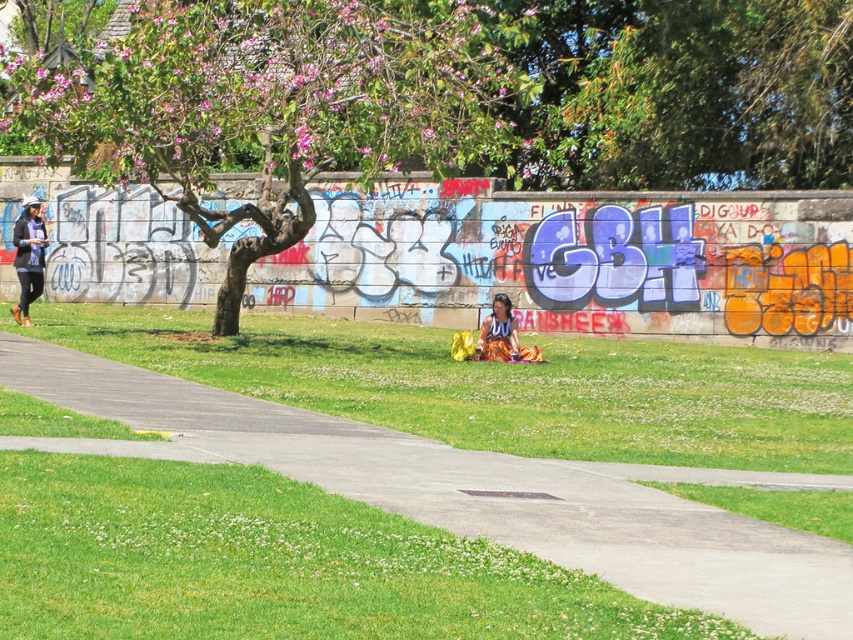
You are a gardener who needs to water the green grass at center. You have a watering can that can spray water up to 3 meters. Is the pink flowered tree at upper left within range of your watering can?

The pink flowered tree at upper left is 3.18 meters from the green grass at center. Since the watering can can only spray up to 3 meters, the distance is slightly beyond its range. Therefore, the pink flowered tree at upper left is out of reach of the watering can.

You are planning to place a small garden statue that requires a stable, flat surface. Based on the scene, which object between the gray concrete pavement at center and the green grass at center would be more suitable for placing the statue?

The gray concrete pavement at center is below the green grass at center, so the gray concrete pavement at center would provide a stable, flat surface for placing the statue.